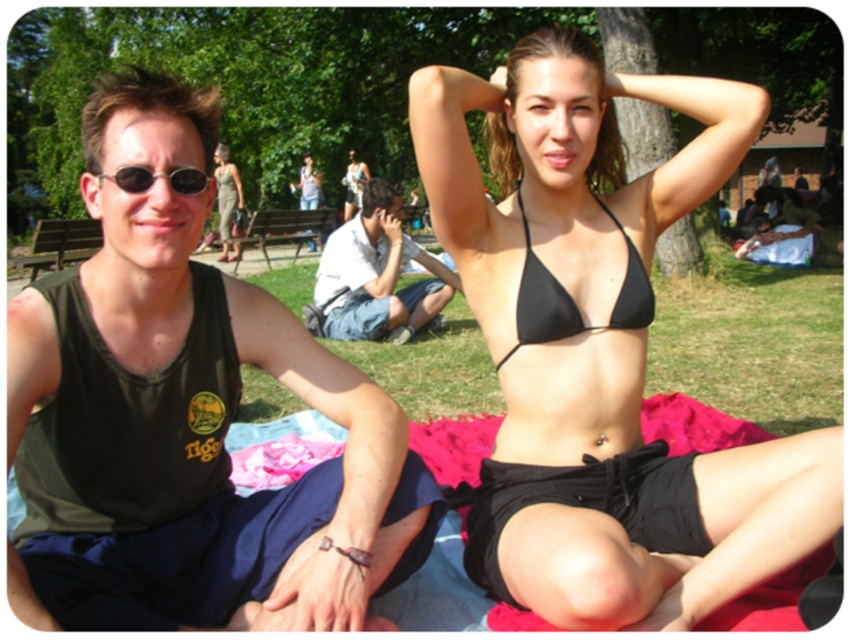
You are a photographer taking a picture of two people sitting on a red blanket. You need to ensure that both the dark green tank top at left and the white cotton shirt at center are clearly visible. Based on their positions, which one is located more to the left side of the image?

The dark green tank top at left is positioned on the left side of the white cotton shirt at center, so the dark green tank top at left is more to the left in the image.

From the picture: You are a photographer taking a picture of the two people on the red blanket. You notice the black matte bikini top at upper center and the sunglasses at left. Which object should you focus on if you want to capture the one that is taller in the frame?

The black matte bikini top at upper center is taller than the sunglasses at left, so you should focus on the black matte bikini top at upper center.